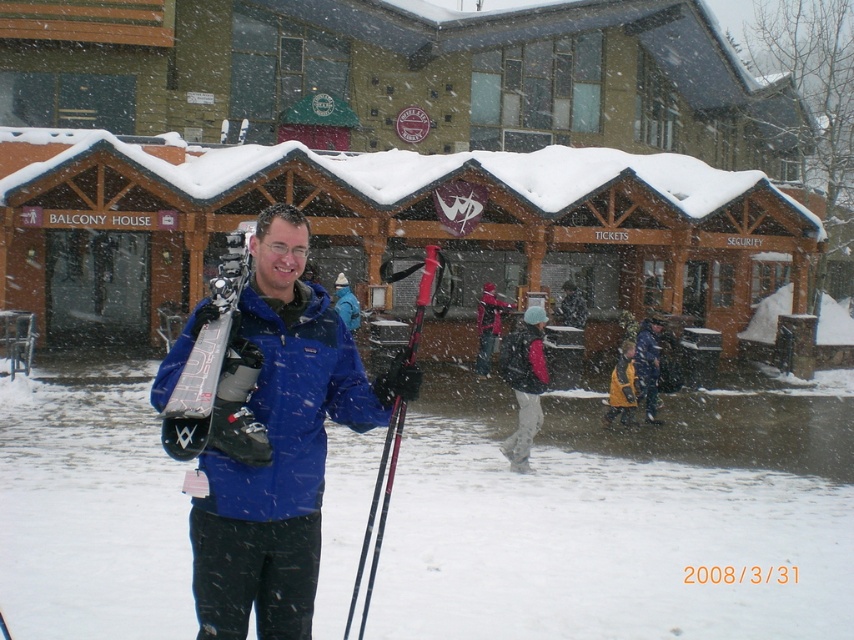
You are a photographer trying to capture the matte black ski at center in your shot. The camera is positioned at the origin point. Which direction should you move the camera to focus on the ski?

The matte black ski at center is located at point 0.586 on the x axis and 0.256 on the y axis. Since the camera is at the origin, you should move the camera to the right along the x axis and slightly up along the y axis to focus on the ski.

You are planning to place both the matte black ski at center and the yellow matte jacket at center on a small shelf. Based on the scene description, which item should you place first to ensure both fit on the shelf?

The matte black ski at center occupies less space than the yellow matte jacket at center, so you should place the yellow matte jacket at center first to ensure both fit on the shelf.